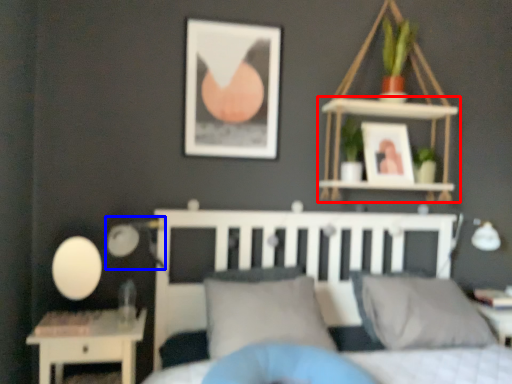
Question: Which object appears closest to the camera in this image, shelf (highlighted by a red box) or table lamp (highlighted by a blue box)?

Choices:
 (A) shelf
 (B) table lamp

Answer: (B)